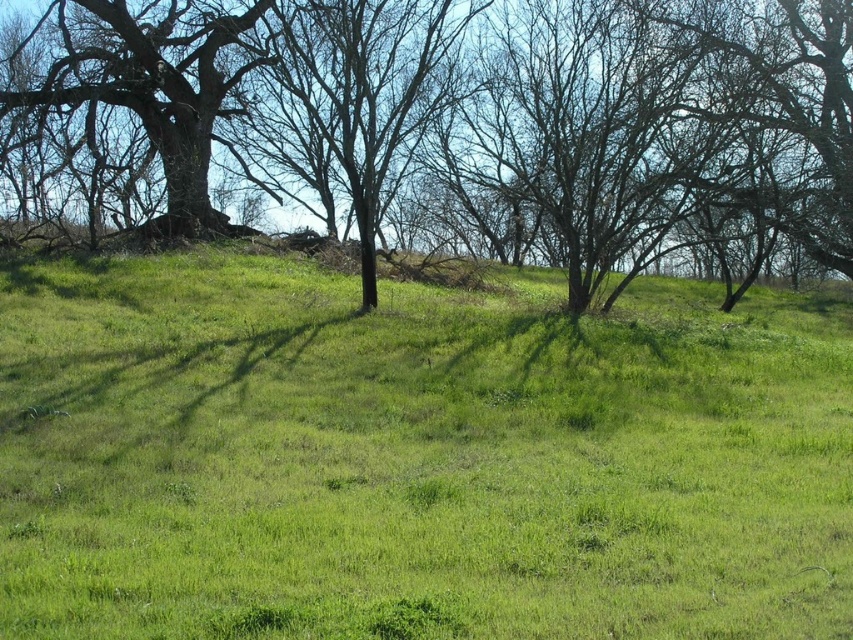
Question: Which of these objects is positioned farthest from the smooth bark tree at left?

Choices:
 (A) green grassy hillside at center
 (B) brown rough bark tree at upper left

Answer: (A)

Question: Which of the following is the closest to the observer?

Choices:
 (A) (840, 250)
 (B) (602, 442)

Answer: (B)

Question: Does brown rough bark tree at upper left come behind smooth bark tree at left?

Choices:
 (A) yes
 (B) no

Answer: (B)

Question: Which of the following is the farthest from the observer?

Choices:
 (A) (177, 563)
 (B) (70, 0)

Answer: (B)

Question: Does brown rough bark tree at upper left appear on the right side of smooth bark tree at left?

Choices:
 (A) no
 (B) yes

Answer: (B)

Question: Does brown rough bark tree at upper left have a larger size compared to smooth bark tree at left?

Choices:
 (A) yes
 (B) no

Answer: (A)